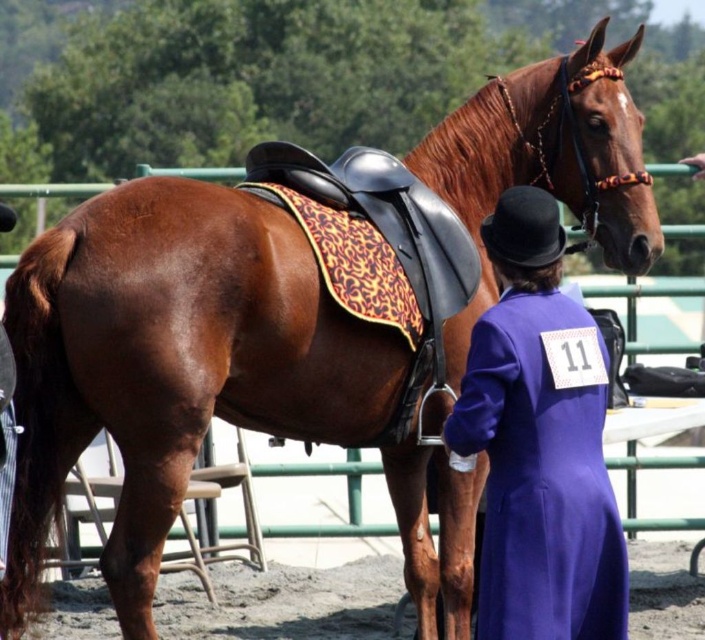
You are a photographer at the horse show and want to take a photo of the purple wool coat at center and the dirt field at lower center. Which object is positioned closer to the camera?

The purple wool coat at center is closer to the viewer than the dirt field at lower center, so it will appear closer to the camera in the photo.

You are a photographer at the horse show and need to capture a clear photo of both the purple wool coat at center and the dirt field at lower center. Based on their heights, which object should be placed closer to the camera to ensure both are in focus?

The purple wool coat at center is taller than the dirt field at lower center. To ensure both are in focus, place the purple wool coat at center closer to the camera since it is taller and requires more attention to capture details.